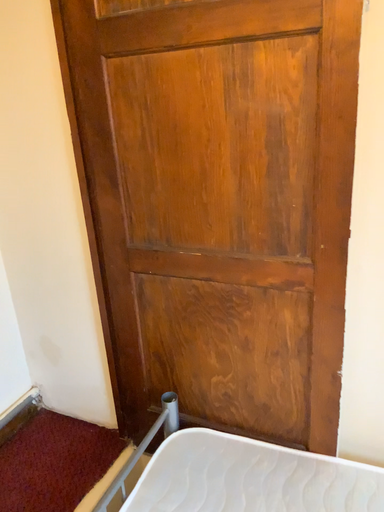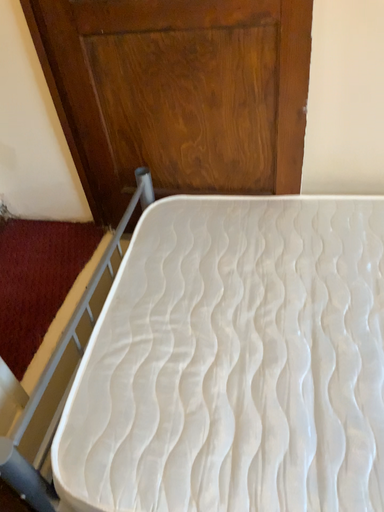
Question: How did the camera likely rotate when shooting the video?

Choices:
 (A) rotated right
 (B) rotated left

Answer: (A)